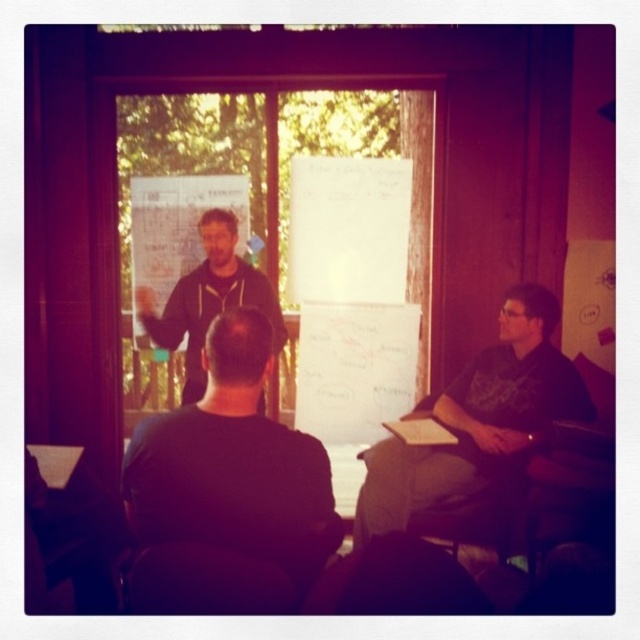
Question: Considering the real-world distances, which object is closest to the matte black hoodie at center?

Choices:
 (A) black matte shirt at center
 (B) white matte board at center

Answer: (B)

Question: Is black matte shirt at center closer to camera compared to dark gray shirt at right?

Choices:
 (A) yes
 (B) no

Answer: (A)

Question: Where is dark gray shirt at right located in relation to white matte board at center in the image?

Choices:
 (A) below
 (B) above

Answer: (A)

Question: Among these objects, which one is farthest from the camera?

Choices:
 (A) dark gray shirt at right
 (B) white matte board at center

Answer: (B)

Question: Is black matte shirt at center positioned before matte black hoodie at center?

Choices:
 (A) yes
 (B) no

Answer: (A)

Question: Which point is closer to the camera?

Choices:
 (A) black matte shirt at center
 (B) dark gray shirt at right
 (C) white matte board at center

Answer: (A)